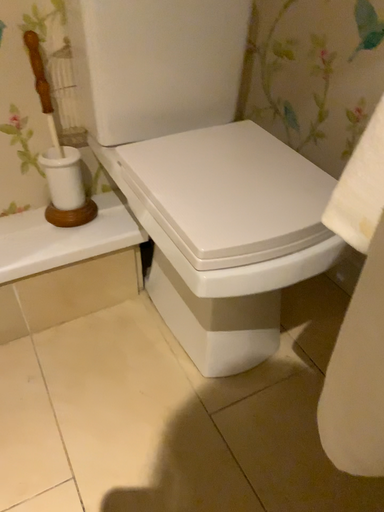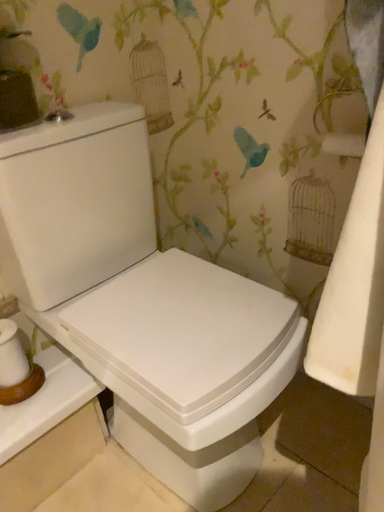
Question: Which way did the camera rotate in the video?

Choices:
 (A) rotated upward
 (B) rotated downward

Answer: (A)